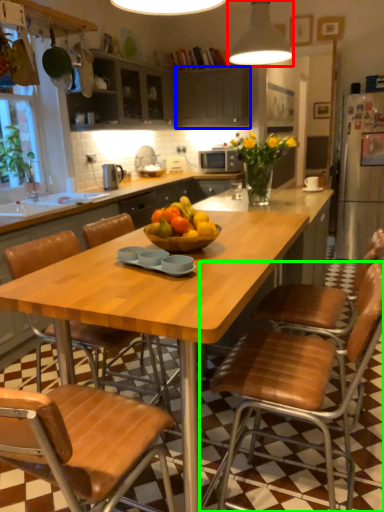
Question: Which object is positioned closest to light fixture (highlighted by a red box)? Select from cabinetry (highlighted by a blue box) and chair (highlighted by a green box).

Choices:
 (A) cabinetry
 (B) chair

Answer: (B)